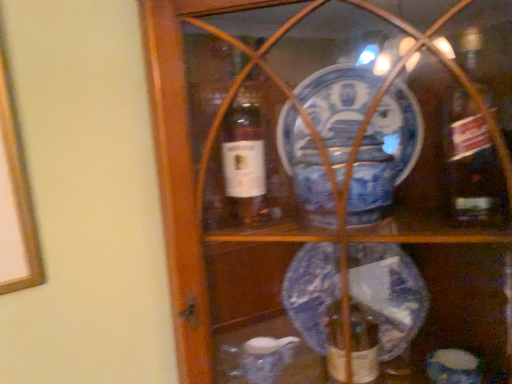
This screenshot has height=384, width=512. What do you see at coordinates (332, 181) in the screenshot?
I see `blue porcelain plate at center` at bounding box center [332, 181].

Locate an element on the screen. The height and width of the screenshot is (384, 512). blue porcelain plate at center is located at coordinates (332, 181).

The image size is (512, 384). Find the location of `blue porcelain plate at center`. blue porcelain plate at center is located at coordinates (332, 181).